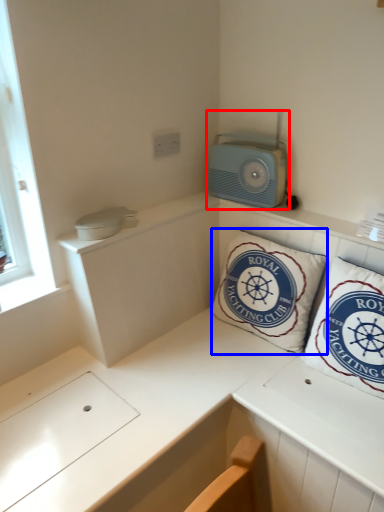
Question: Which of the following is the closest to the observer, appliance (highlighted by a red box) or pillow (highlighted by a blue box)?

Choices:
 (A) appliance
 (B) pillow

Answer: (B)